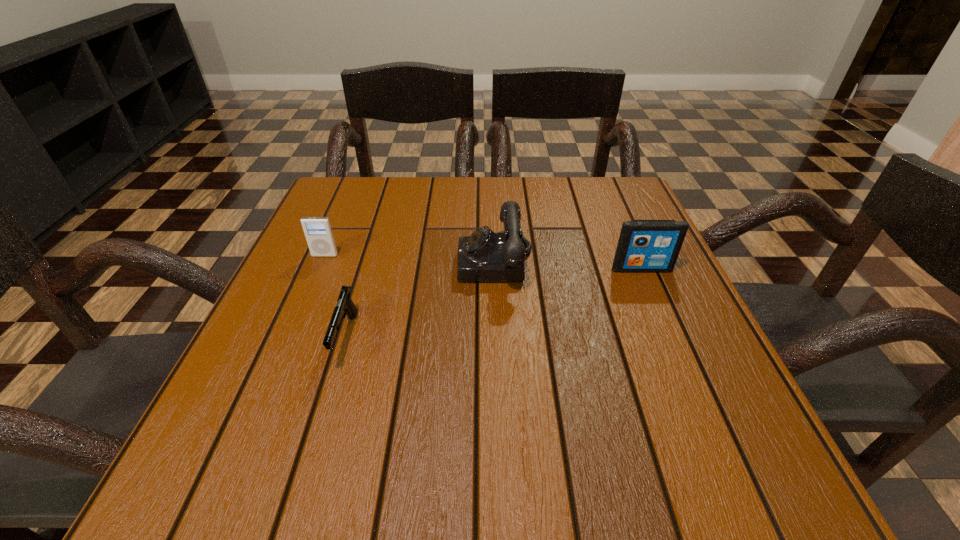
Identify the location of the second object from right to left. (485, 256).

Locate an element on the screen. This screenshot has height=540, width=960. the right iPod is located at coordinates [x=645, y=246].

The image size is (960, 540). Identify the location of the taller iPod. (645, 246).

You are a GUI agent. You are given a task and a screenshot of the screen. Output one action in this format:
    pyautogui.click(x=<x>, y=<y>)
    Task: Click on the second shortest object
    
    Given the screenshot: What is the action you would take?
    pyautogui.click(x=318, y=232)

Find the location of a particular element. the left iPod is located at coordinates (318, 232).

Find the location of a particular element. the shortest object is located at coordinates (345, 306).

At what (x,y) coordinates should I click in order to perform the action: click on the nearest object. Please return your answer as a coordinate pair (x, y). This screenshot has width=960, height=540. Looking at the image, I should click on (345, 306).

Find the location of a particular element. The image size is (960, 540). vacant space located on the dial of the telephone is located at coordinates click(x=407, y=262).

Locate an element on the screen. This screenshot has width=960, height=540. free space located on the dial of the telephone is located at coordinates (412, 262).

At what (x,y) coordinates should I click in order to perform the action: click on free space located 0.090m on the dial of the telephone. Please return your answer as a coordinate pair (x, y). The width and height of the screenshot is (960, 540). Looking at the image, I should click on (417, 262).